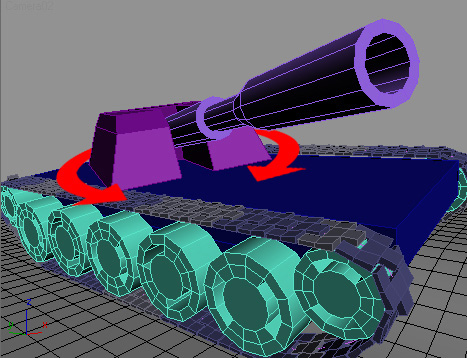
At what (x,y) coordinates should I click in order to perform the action: click on corner. Please return your answer as a coordinate pair (x, y). The width and height of the screenshot is (467, 358). Looking at the image, I should click on (183, 157).